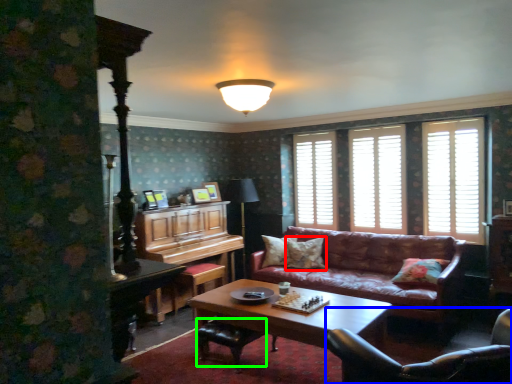
Question: Which is farther away from pillow (highlighted by a red box)? chair (highlighted by a blue box) or footrest (highlighted by a green box)?

Choices:
 (A) chair
 (B) footrest

Answer: (A)